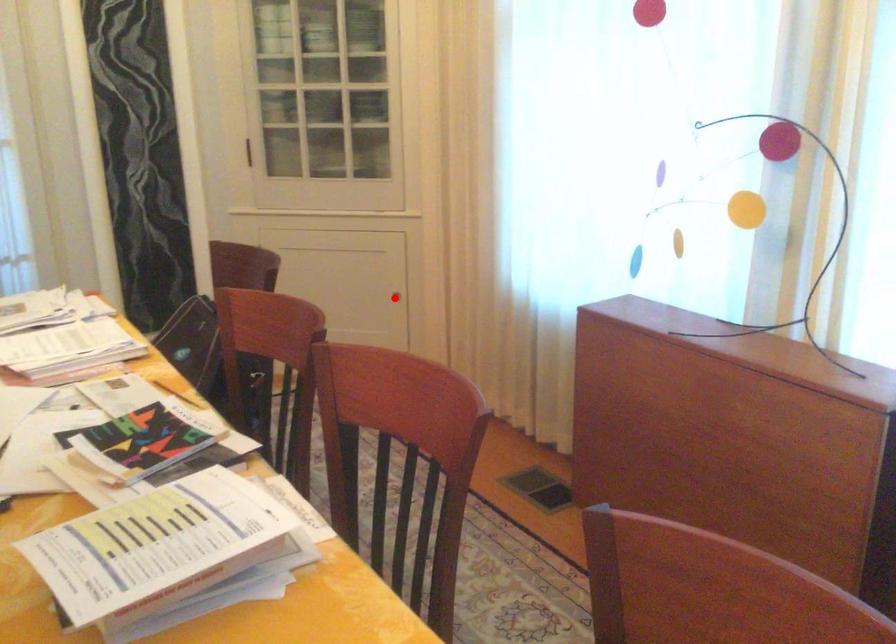
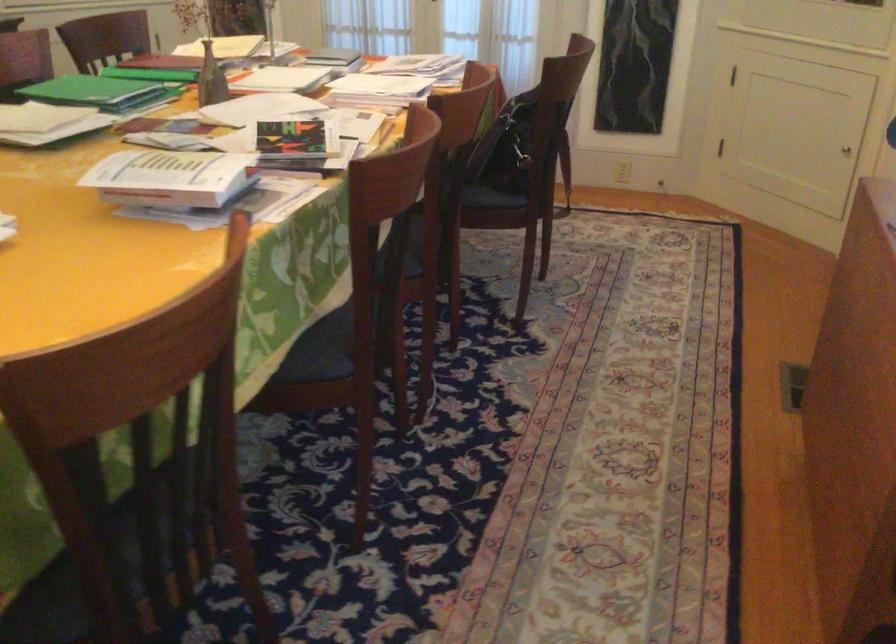
Question: I am providing you with two images of the same scene from different viewpoints. A red point is shown in image1. For the corresponding object point in image2, is it positioned nearer or farther from the camera?

Choices:
 (A) Nearer
 (B) Farther

Answer: (A)